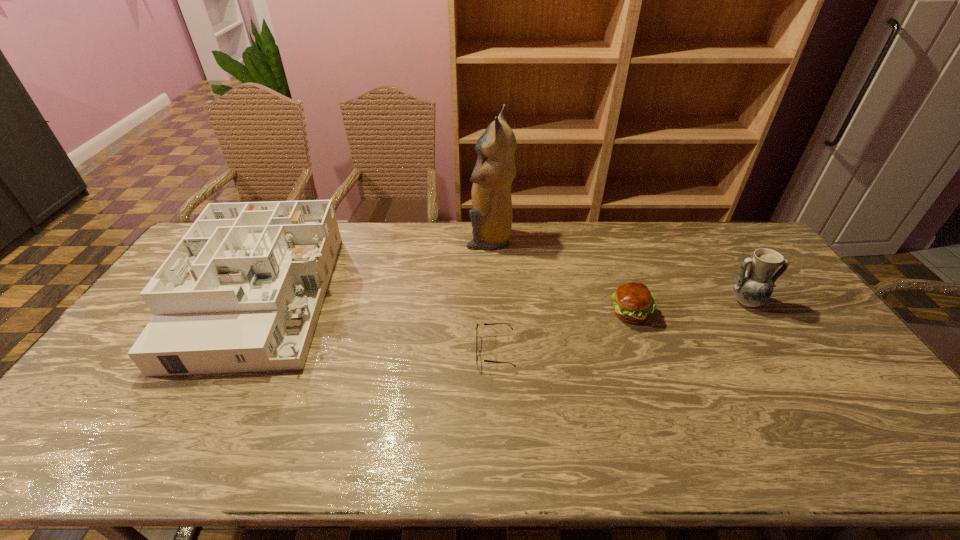
This screenshot has width=960, height=540. Find the location of `vacant space that is in between the pottery and the hamburger`. vacant space that is in between the pottery and the hamburger is located at coordinates (687, 308).

This screenshot has width=960, height=540. I want to click on vacant space that's between the tallest object and the hamburger, so click(x=560, y=276).

Find the location of a particular element. free point between the rightmost object and the leftmost object is located at coordinates (502, 300).

Where is `the fourth closest object relative to the leftmost object`? This screenshot has width=960, height=540. the fourth closest object relative to the leftmost object is located at coordinates (752, 288).

Choose which object is the fourth nearest neighbor to the hamburger. Please provide its 2D coordinates. Your answer should be formatted as a tuple, i.e. [(x, y)], where the tuple contains the x and y coordinates of a point satisfying the conditions above.

[(242, 291)]

Identify the location of free spot that satisfies the following two spatial constraints: 1. on the back side of the fourth object from left to right; 2. on the face of the tallest object. (604, 239).

This screenshot has width=960, height=540. Find the location of `blank area in the image that satisfies the following two spatial constraints: 1. on the front side of the dollhouse; 2. on the right side of the fourth object from left to right`. blank area in the image that satisfies the following two spatial constraints: 1. on the front side of the dollhouse; 2. on the right side of the fourth object from left to right is located at coordinates (251, 313).

In order to click on vacant space that satisfies the following two spatial constraints: 1. on the back side of the fourth object from left to right; 2. on the face of the tallest object in this screenshot , I will do `click(604, 239)`.